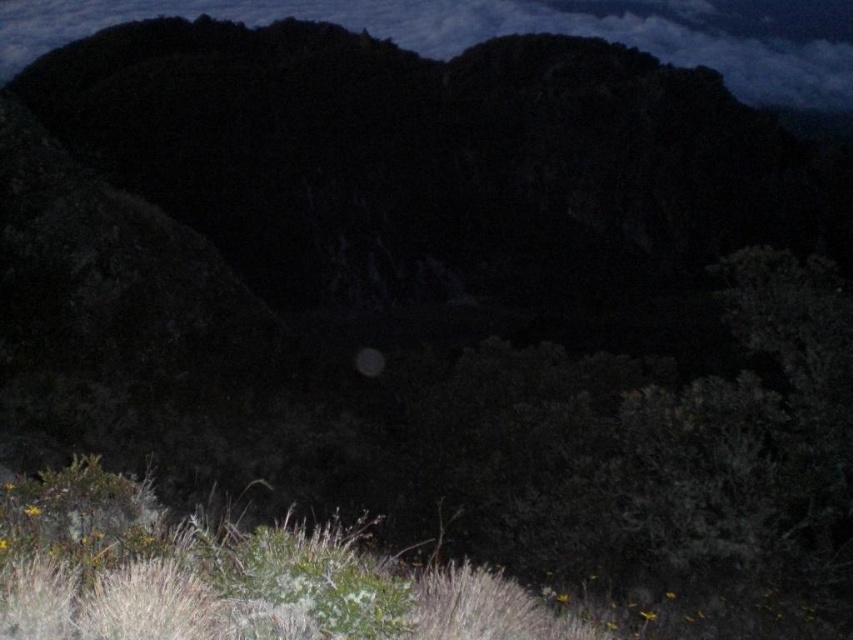
Question: Which object appears farthest from the camera in this image?

Choices:
 (A) cloudy sky at upper center
 (B) gray matte moon at center

Answer: (A)

Question: In this image, where is cloudy sky at upper center located relative to gray matte moon at center?

Choices:
 (A) left
 (B) right

Answer: (B)

Question: Does cloudy sky at upper center appear over gray matte moon at center?

Choices:
 (A) no
 (B) yes

Answer: (B)

Question: Does cloudy sky at upper center have a lesser width compared to gray matte moon at center?

Choices:
 (A) no
 (B) yes

Answer: (A)

Question: Which of the following is the closest to the observer?

Choices:
 (A) cloudy sky at upper center
 (B) gray matte moon at center

Answer: (B)